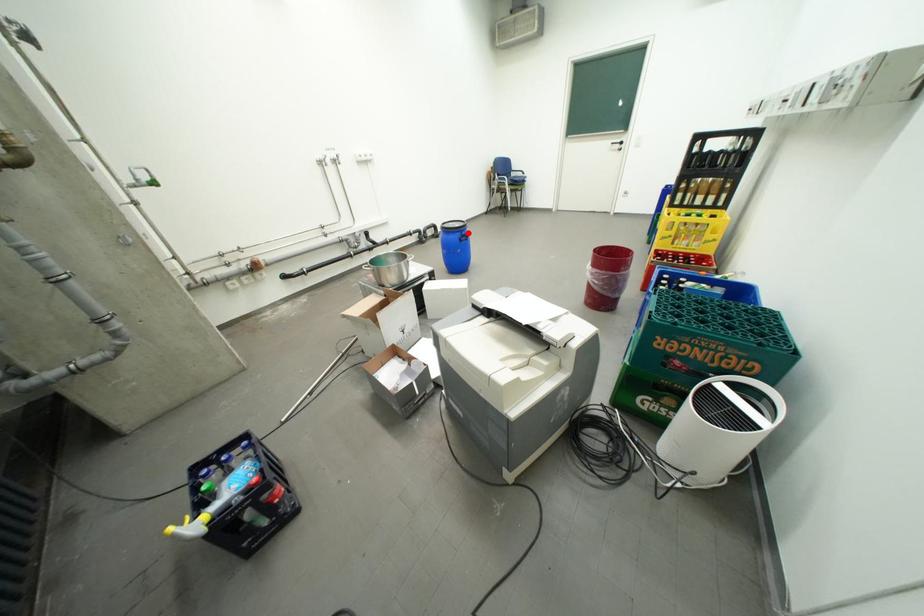
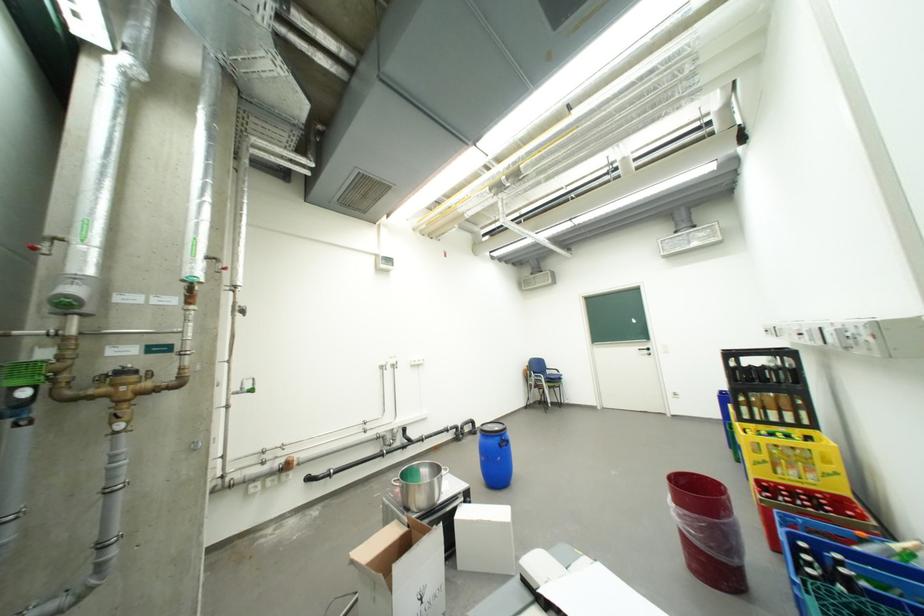
Question: I am providing you with two images of the same scene from different viewpoints. A red point is shown in image1. For the corresponding object point in image2, is it positioned nearer or farther from the camera?

Choices:
 (A) Nearer
 (B) Farther

Answer: (B)